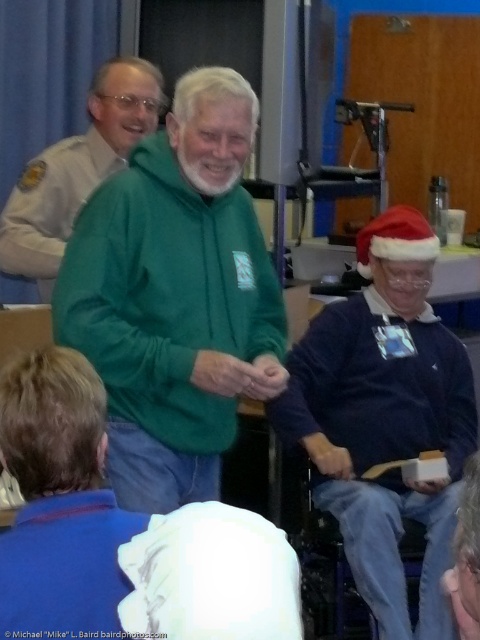
Where is the green fleece jacket at center located in the image?

The green fleece jacket at center is located at point [176,296] in the image.

You are taking a photo of the scene and want to focus on both point (227, 128) and point (63, 188). Which point should you focus on first to ensure both are in focus?

You should focus on point (227, 128) first because it is closer to the camera than point (63, 188), allowing the depth of field to cover both points effectively.

You are organizing a gift exchange and need to arrange participants in a line from left to right based on their clothing. Given the positions of the blue sweater at lower right and green fleece at center, which clothing item should be placed first in the line?

The green fleece at center should be placed first in the line since the blue sweater at lower right is positioned on the right side of it, meaning the green fleece at center is to the left.